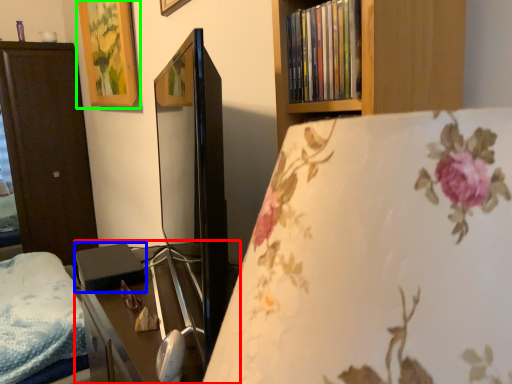
Question: Considering the real-world distances, which object is farthest from table (highlighted by a red box)? paperback book (highlighted by a blue box) or picture frame (highlighted by a green box)?

Choices:
 (A) paperback book
 (B) picture frame

Answer: (B)